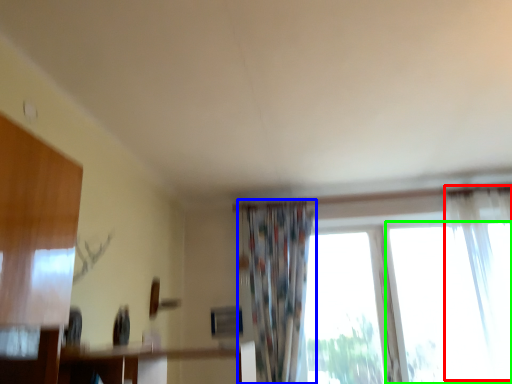
Question: Based on their relative distances, which object is farther from curtain (highlighted by a red box)? Choose from curtain (highlighted by a blue box) and window (highlighted by a green box).

Choices:
 (A) curtain
 (B) window

Answer: (A)